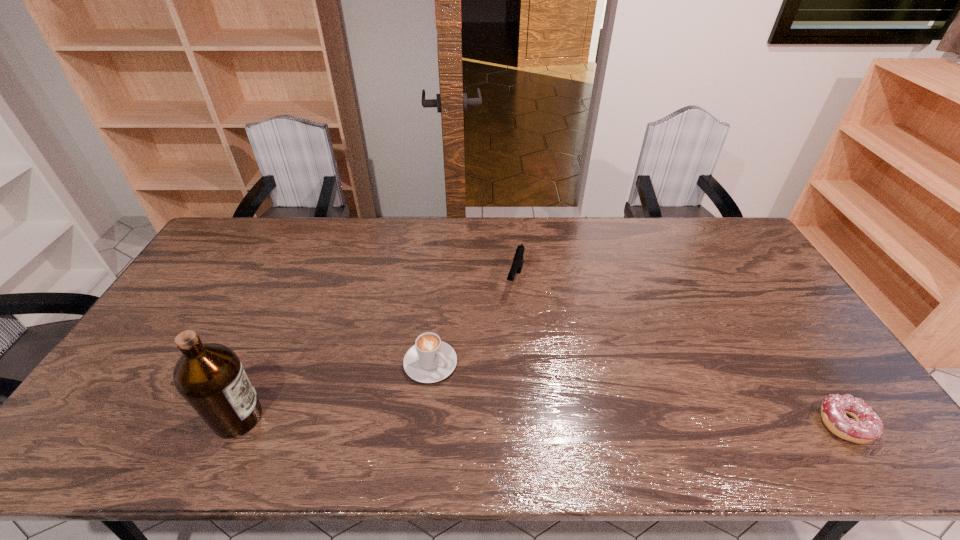
You are a GUI agent. You are given a task and a screenshot of the screen. Output one action in this format:
    pyautogui.click(x=<x>, y=<y>)
    Task: Click on the vacant space in between the doughnut and the pistol
    
    Given the screenshot: What is the action you would take?
    pos(680,352)

Identify the location of empty location between the leftmost object and the second farthest object. The height and width of the screenshot is (540, 960). (334, 390).

Image resolution: width=960 pixels, height=540 pixels. In order to click on vacant space that's between the doughnut and the third nearest object in this screenshot , I will do `click(637, 394)`.

Find the location of a particular element. The width and height of the screenshot is (960, 540). empty space that is in between the leftmost object and the farthest object is located at coordinates (376, 349).

Identify the location of free space between the farthest object and the cappuccino. (473, 321).

Locate which object ranks in proximity to the farthest object. Please provide its 2D coordinates. Your answer should be formatted as a tuple, i.e. [(x, y)], where the tuple contains the x and y coordinates of a point satisfying the conditions above.

[(430, 360)]

I want to click on object that stands as the closest to the second object from right to left, so click(430, 360).

Locate an element on the screen. vacant space that satisfies the following two spatial constraints: 1. on the front side of the doughnut; 2. on the right side of the third object from left to right is located at coordinates (528, 424).

I want to click on free spot that satisfies the following two spatial constraints: 1. on the back side of the farthest object; 2. on the left side of the second object from left to right, so click(x=439, y=280).